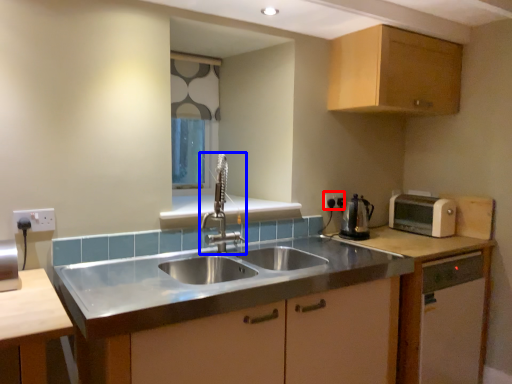
Question: Which point is further to the camera, electric outlet (highlighted by a red box) or tap (highlighted by a blue box)?

Choices:
 (A) electric outlet
 (B) tap

Answer: (A)